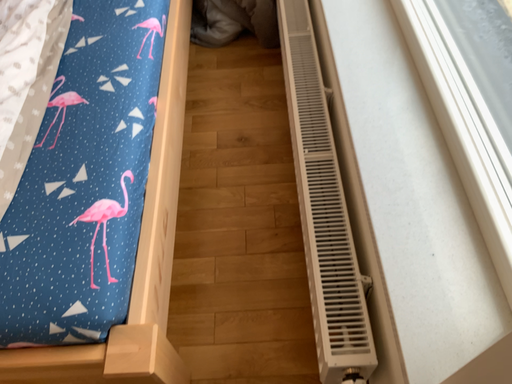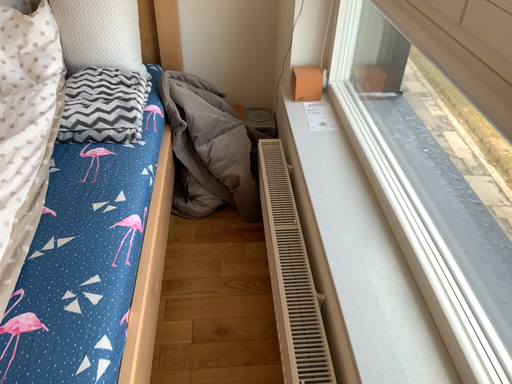
Question: Which way did the camera rotate in the video?

Choices:
 (A) rotated upward
 (B) rotated downward

Answer: (A)